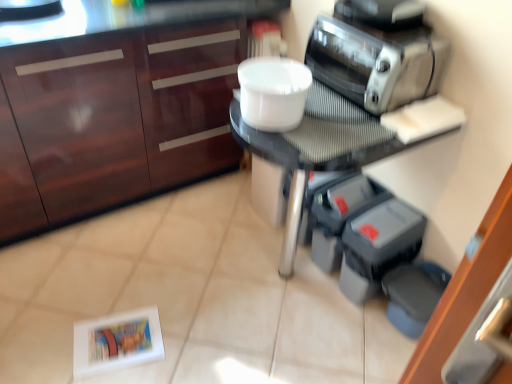
Question: Can you confirm if gray rubber dumbbells at lower right, which is the first appliance from right to left, is bigger than metallic silver toaster at upper right?

Choices:
 (A) no
 (B) yes

Answer: (B)

Question: Can you confirm if gray rubber dumbbells at lower right, arranged as the 2th appliance when viewed from the left, is positioned to the right of metallic silver toaster at upper right?

Choices:
 (A) yes
 (B) no

Answer: (A)

Question: From a real-world perspective, does gray rubber dumbbells at lower right, which is the first appliance from right to left, stand above metallic silver toaster at upper right?

Choices:
 (A) yes
 (B) no

Answer: (B)

Question: Is gray rubber dumbbells at lower right, which is the first appliance from right to left, outside metallic silver toaster at upper right?

Choices:
 (A) no
 (B) yes

Answer: (B)

Question: Can you confirm if gray rubber dumbbells at lower right, arranged as the 2th appliance when viewed from the left, is taller than metallic silver toaster at upper right?

Choices:
 (A) no
 (B) yes

Answer: (B)

Question: From a real-world perspective, does gray rubber dumbbells at lower right, arranged as the 2th appliance when viewed from the left, sit lower than metallic silver toaster at upper right?

Choices:
 (A) no
 (B) yes

Answer: (B)

Question: From a real-world perspective, is matte wood cabinetry at upper left under white plastic bowl at center?

Choices:
 (A) no
 (B) yes

Answer: (B)

Question: Is white plastic bowl at center located within matte wood cabinetry at upper left?

Choices:
 (A) yes
 (B) no

Answer: (B)

Question: From the image's perspective, is matte wood cabinetry at upper left below white plastic bowl at center?

Choices:
 (A) no
 (B) yes

Answer: (A)

Question: From a real-world perspective, is matte wood cabinetry at upper left located higher than white plastic bowl at center?

Choices:
 (A) yes
 (B) no

Answer: (B)

Question: Can you confirm if matte wood cabinetry at upper left is positioned to the left of white plastic bowl at center?

Choices:
 (A) no
 (B) yes

Answer: (B)

Question: Can you confirm if matte wood cabinetry at upper left is taller than white plastic bowl at center?

Choices:
 (A) no
 (B) yes

Answer: (B)

Question: Considering the relative sizes of metallic silver toaster at upper right and gray plastic containers at lower right, the 1th appliance when ordered from left to right, in the image provided, is metallic silver toaster at upper right bigger than gray plastic containers at lower right, the 1th appliance when ordered from left to right,?

Choices:
 (A) yes
 (B) no

Answer: (B)